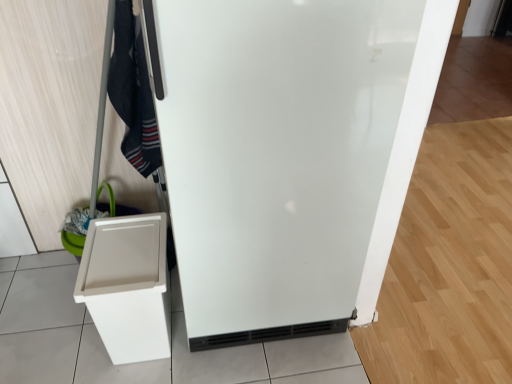
What is the approximate width of black cotton scarf at upper left?

6.71 inches.

What is the approximate height of black cotton scarf at upper left?

black cotton scarf at upper left is 23.14 inches in height.

I want to click on white glossy refrigerator at center, so click(288, 152).

Is white glossy refrigerator at center not inside white plastic bin at lower left?

Yes, white glossy refrigerator at center is located beyond the bounds of white plastic bin at lower left.

Is white glossy refrigerator at center beside white plastic bin at lower left?

No, white glossy refrigerator at center is not making contact with white plastic bin at lower left.

Looking at this image, is white glossy refrigerator at center smaller than white plastic bin at lower left?

No, white glossy refrigerator at center is not smaller than white plastic bin at lower left.

How much distance is there between white glossy refrigerator at center and white plastic bin at lower left?

white glossy refrigerator at center and white plastic bin at lower left are 17.05 inches apart.

Who is shorter, white plastic bin at lower left or white glossy refrigerator at center?

With less height is white plastic bin at lower left.

Is there a large distance between white plastic bin at lower left and white glossy refrigerator at center?

white plastic bin at lower left is actually quite close to white glossy refrigerator at center.

Considering the sizes of objects white plastic bin at lower left and white glossy refrigerator at center in the image provided, who is bigger, white plastic bin at lower left or white glossy refrigerator at center?

Bigger between the two is white glossy refrigerator at center.

Is white plastic bin at lower left behind white glossy refrigerator at center?

Yes, it is.

Is black cotton scarf at upper left oriented towards white plastic bin at lower left?

No, black cotton scarf at upper left is not turned towards white plastic bin at lower left.

Is white plastic bin at lower left surrounded by black cotton scarf at upper left?

No.

From the image's perspective, relative to white plastic bin at lower left, is black cotton scarf at upper left above or below?

black cotton scarf at upper left is situated higher than white plastic bin at lower left in the image.

Is point (127, 69) positioned after point (147, 288)?

No, (127, 69) is closer to viewer.

At what (x,y) coordinates should I click in order to perform the action: click on clothing that is on the right side of white plastic bin at lower left. Please return your answer as a coordinate pair (x, y). The image size is (512, 384). Looking at the image, I should click on (133, 92).

From the image's perspective, which one is positioned lower, white plastic bin at lower left or black cotton scarf at upper left?

From the image's view, white plastic bin at lower left is below.

Is white plastic bin at lower left turned away from black cotton scarf at upper left?

No, black cotton scarf at upper left is not at the back of white plastic bin at lower left.

Is white plastic bin at lower left placed right next to black cotton scarf at upper left?

No, white plastic bin at lower left is not making contact with black cotton scarf at upper left.

In the image, is white glossy refrigerator at center on the left side or the right side of black cotton scarf at upper left?

Based on their positions, white glossy refrigerator at center is located to the right of black cotton scarf at upper left.

Locate an element on the screen. refrigerator located below the black cotton scarf at upper left (from the image's perspective) is located at coordinates (288, 152).

Is white glossy refrigerator at center in front of or behind black cotton scarf at upper left in the image?

Clearly, white glossy refrigerator at center is in front of black cotton scarf at upper left.

In the scene shown: How different are the orientations of white glossy refrigerator at center and black cotton scarf at upper left in degrees?

They differ by 6.39e-05 degrees in their facing directions.

Are black cotton scarf at upper left and white glossy refrigerator at center making contact?

No, black cotton scarf at upper left is not with white glossy refrigerator at center.

Is black cotton scarf at upper left taller than white glossy refrigerator at center?

No, black cotton scarf at upper left is not taller than white glossy refrigerator at center.

Is black cotton scarf at upper left aimed at white glossy refrigerator at center?

No, black cotton scarf at upper left is not facing towards white glossy refrigerator at center.

Identify the location of cabinetry behind the white glossy refrigerator at center. (128, 286).

Locate an element on the screen. This screenshot has width=512, height=384. refrigerator on the right of white plastic bin at lower left is located at coordinates (288, 152).

Considering their positions, is black cotton scarf at upper left positioned closer to white plastic bin at lower left than white glossy refrigerator at center?

The object closer to white plastic bin at lower left is black cotton scarf at upper left.

When comparing their distances from white glossy refrigerator at center, does white plastic bin at lower left or black cotton scarf at upper left seem closer?

white plastic bin at lower left is closer to white glossy refrigerator at center.

Considering their positions, is white glossy refrigerator at center positioned further to black cotton scarf at upper left than white plastic bin at lower left?

Among the two, white glossy refrigerator at center is located further to black cotton scarf at upper left.

Based on their spatial positions, is white plastic bin at lower left or white glossy refrigerator at center further from black cotton scarf at upper left?

white glossy refrigerator at center lies further to black cotton scarf at upper left than the other object.

Looking at this image, based on their spatial positions, is black cotton scarf at upper left or white plastic bin at lower left closer to white glossy refrigerator at center?

The object closer to white glossy refrigerator at center is white plastic bin at lower left.

Looking at this image, considering their positions, is white glossy refrigerator at center positioned further to white plastic bin at lower left than black cotton scarf at upper left?

white glossy refrigerator at center lies further to white plastic bin at lower left than the other object.

Where is `refrigerator between black cotton scarf at upper left and white plastic bin at lower left from top to bottom`? This screenshot has height=384, width=512. refrigerator between black cotton scarf at upper left and white plastic bin at lower left from top to bottom is located at coordinates (x=288, y=152).